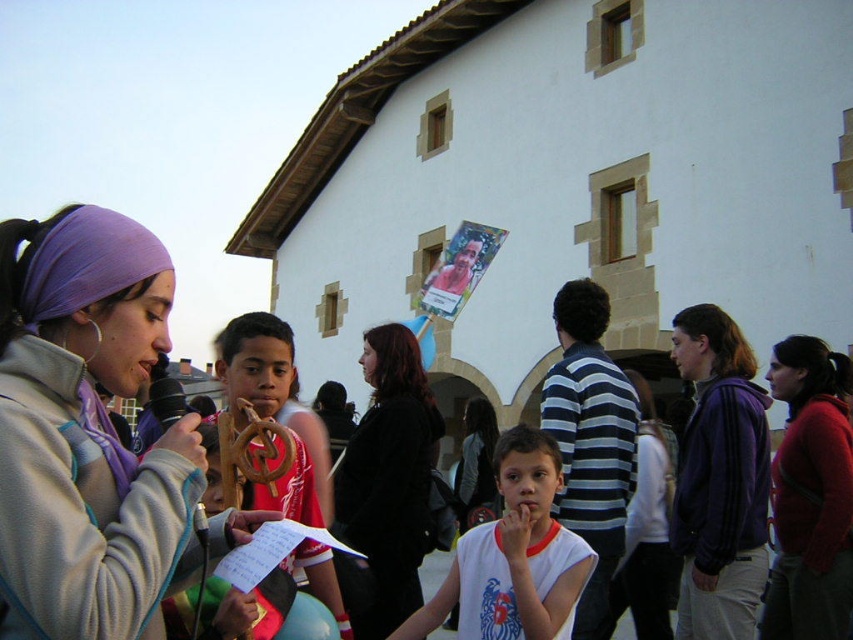
Can you confirm if black matte jacket at center is smaller than white matte shirt at center?

Yes, black matte jacket at center is smaller than white matte shirt at center.

Can you confirm if black matte jacket at center is bigger than white matte shirt at center?

No, black matte jacket at center is not bigger than white matte shirt at center.

Measure the distance between black matte jacket at center and camera.

black matte jacket at center is 121.18 feet away from camera.

Image resolution: width=853 pixels, height=640 pixels. I want to click on black matte jacket at center, so [387, 481].

Does point (668, 588) come behind point (444, 260)?

No, it is in front of (444, 260).

Between matte black jacket at center and matte paper poster at center, which one appears on the right side from the viewer's perspective?

Positioned to the right is matte black jacket at center.

The image size is (853, 640). Describe the element at coordinates (646, 532) in the screenshot. I see `matte black jacket at center` at that location.

You are a GUI agent. You are given a task and a screenshot of the screen. Output one action in this format:
    pyautogui.click(x=<x>, y=<y>)
    Task: Click on the matte black jacket at center
    
    Given the screenshot: What is the action you would take?
    pyautogui.click(x=646, y=532)

Is purple fabric headband at upper left above white matte shirt at center?

Yes, purple fabric headband at upper left is above white matte shirt at center.

Where is `purple fabric headband at upper left`? purple fabric headband at upper left is located at coordinates (86, 433).

Between point (103, 474) and point (498, 616), which one is positioned in front?

Point (103, 474)

Identify the location of purple fabric headband at upper left. (86, 433).